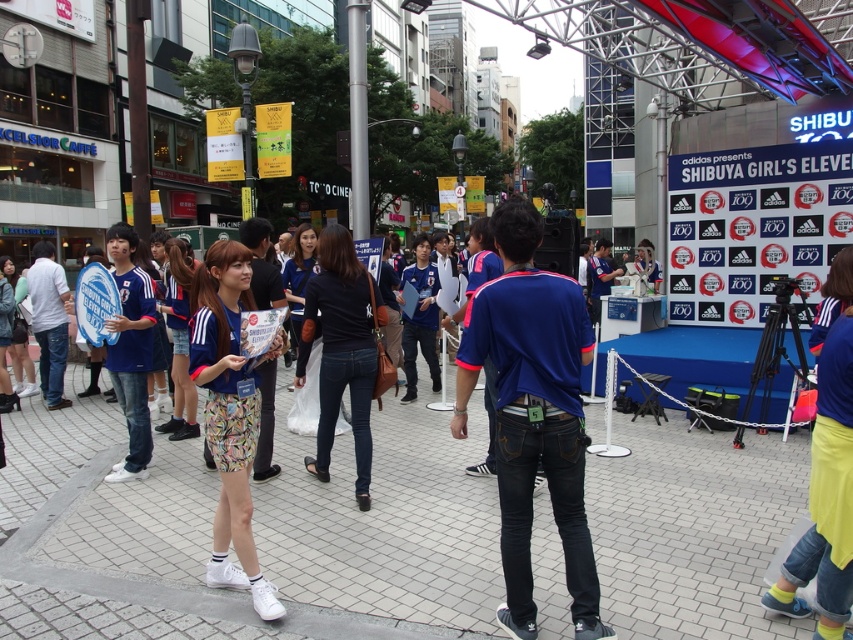
Is blue denim jeans at center to the right of blue denim jeans at left from the viewer's perspective?

Correct, you'll find blue denim jeans at center to the right of blue denim jeans at left.

Does point (529, 244) come in front of point (149, 316)?

Yes, point (529, 244) is in front of point (149, 316).

The width and height of the screenshot is (853, 640). I want to click on blue denim jeans at center, so click(x=532, y=413).

At what (x,y) coordinates should I click in order to perform the action: click on blue denim jeans at center. Please return your answer as a coordinate pair (x, y). The width and height of the screenshot is (853, 640). Looking at the image, I should click on [x=532, y=413].

Does white tile pavement at center come behind blue jersey at center?

Yes, it is.

Is point (711, 493) positioned in front of point (218, 248)?

No, it is behind (218, 248).

Where is `white tile pavement at center`? white tile pavement at center is located at coordinates (386, 531).

Does white tile pavement at center come behind blue denim jeans at center?

That is True.

Is point (393, 563) behind point (526, 522)?

Yes.

This screenshot has width=853, height=640. I want to click on white tile pavement at center, so click(386, 531).